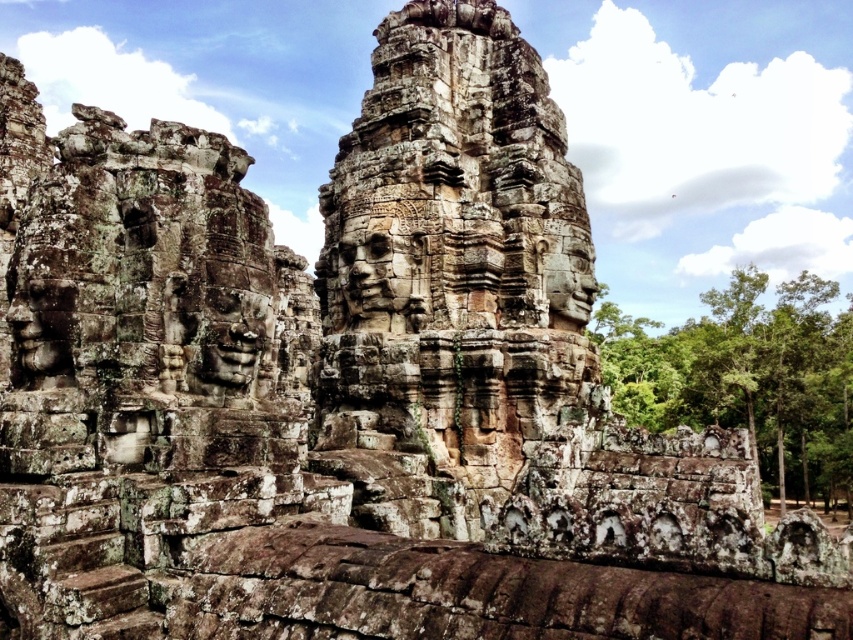
Question: Is rough stone face at center bigger than rustic stone face at center?

Choices:
 (A) no
 (B) yes

Answer: (A)

Question: Is rough stone face at center thinner than rustic stone face at center?

Choices:
 (A) no
 (B) yes

Answer: (B)

Question: Does rough stone face at center have a larger size compared to rustic stone face at center?

Choices:
 (A) no
 (B) yes

Answer: (A)

Question: Which point appears farthest from the camera in this image?

Choices:
 (A) (374, 310)
 (B) (260, 323)

Answer: (A)